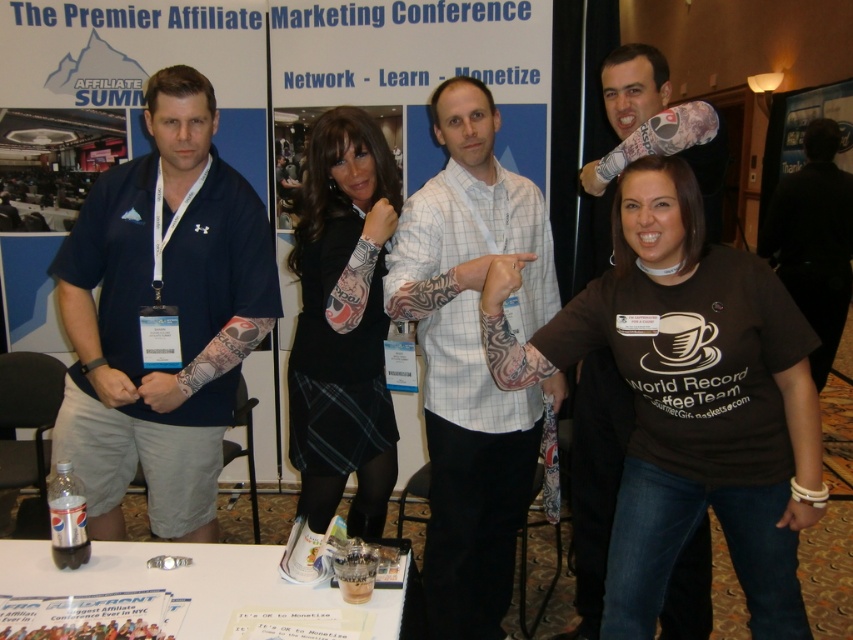
In the photo taken at the Affiliate Summit conference, there are five people dressed in various clothing. One person is wearing a dark blue Under Armour polo shirt, another has a black outfit with a plaid skirt, and there is a brown cotton t shirt at center. Which of these clothing items is located at the exact coordinate point (688, 401)?

The brown cotton t shirt at center is located at the exact coordinate point (688, 401).